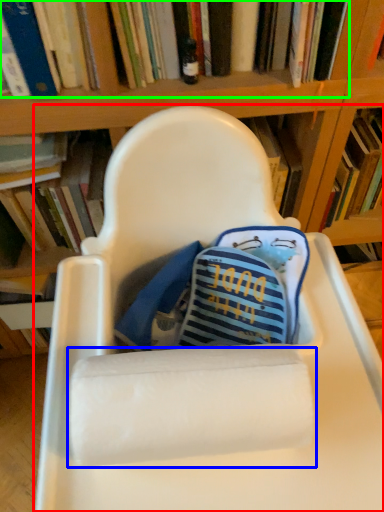
Question: Considering the real-world distances, which object is farthest from chair (highlighted by a red box)? paper towel (highlighted by a blue box) or book (highlighted by a green box)?

Choices:
 (A) paper towel
 (B) book

Answer: (B)